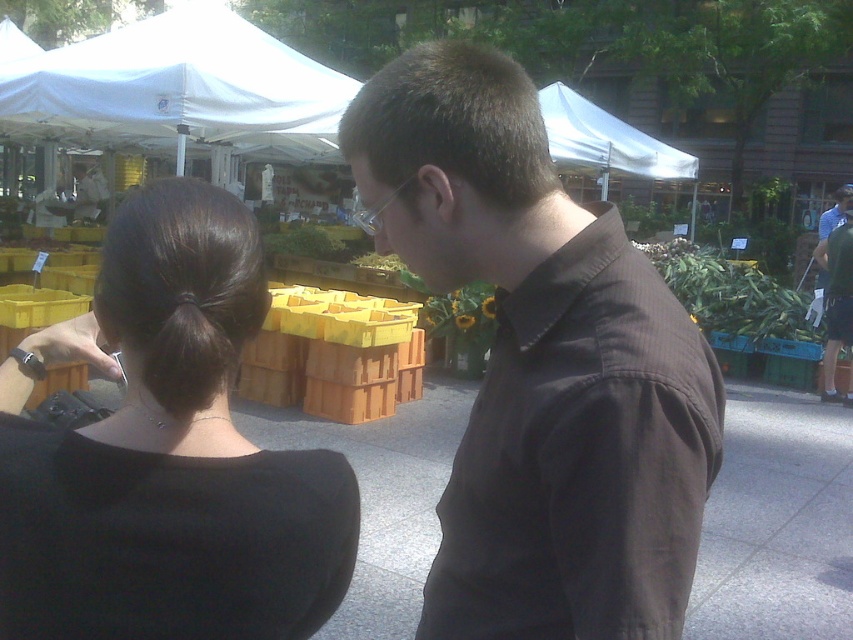
You are a customer at the market and want to buy the green leafy produce at center. The vendor is standing behind the brown smooth shirt at center. Which direction should you move to reach the produce first without passing the vendor?

Move to the left since the brown smooth shirt at center is to the left of green leafy produce at center, so moving left would place you closer to the produce before reaching the vendor.

You are a customer at the market and want to find the tallest white fabric canopy. Which one between the white fabric canopy at upper left and the white fabric canopy at upper center should you look for?

The white fabric canopy at upper left is taller than the white fabric canopy at upper center, so you should look for the white fabric canopy at upper left.